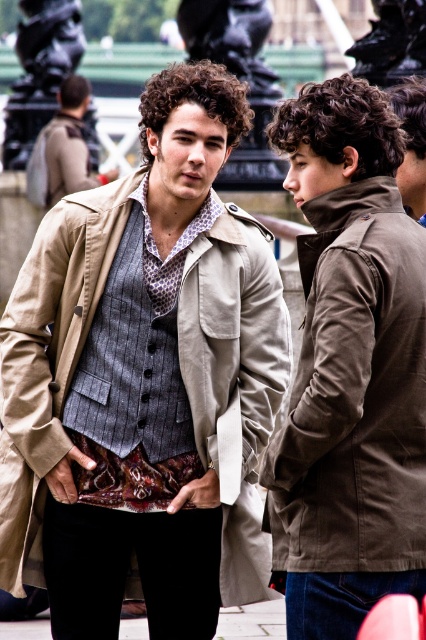
You are a photographer planning to capture a group photo of the beige fabric coat at center and the matte brown jacket at center. Given that your camera has a maximum focus range of 100 feet, will you be able to include both subjects in the same frame without moving closer?

The distance between the beige fabric coat at center and the matte brown jacket at center is 150.22 feet, which exceeds the camera maximum focus range of 100 feet. Therefore, you cannot include both subjects in the same frame without moving closer.

You are a photographer standing at the center of the scene. You want to take a photo that includes both the person in the beige trench coat and the matte brown jacket at right. Based on their positions, which direction should you move to ensure both are in frame?

Since the matte brown jacket at right is positioned at point (350, 371), you should move to the left to ensure both the beige trench coat and the matte brown jacket at right are within the frame.

You are a fashion designer observing two people in an urban setting. You notice the matte brown jacket at right and the matte brown jacket at center. Which one is positioned to the right side of the other?

The matte brown jacket at right is positioned to the right of the matte brown jacket at center.